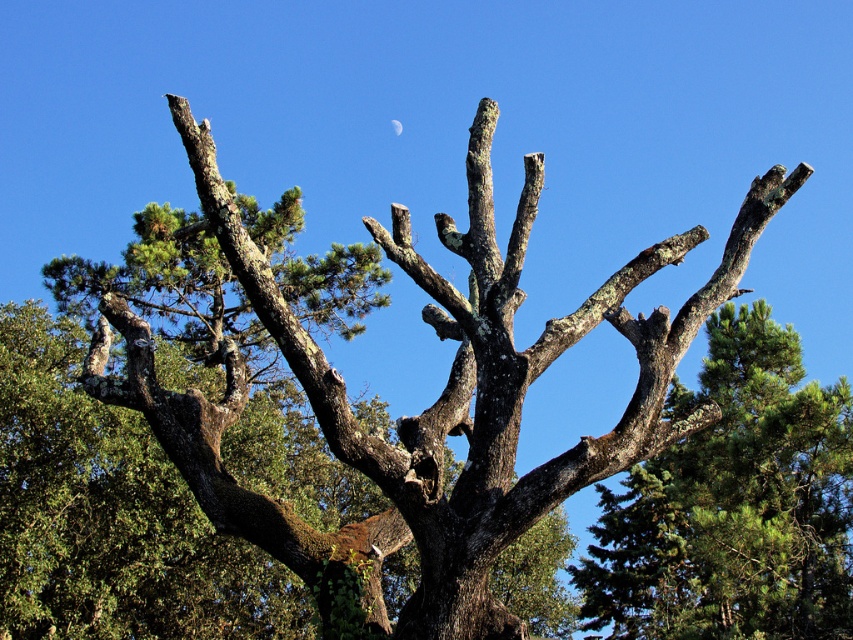
Question: Among these points, which one is nearest to the camera?

Choices:
 (A) (671, 636)
 (B) (390, 122)

Answer: (A)

Question: Among these objects, which one is farthest from the camera?

Choices:
 (A) green mossy branch at center
 (B) silver metallic moon at upper center

Answer: (B)

Question: Does green mossy branch at center have a lesser width compared to silver metallic moon at upper center?

Choices:
 (A) yes
 (B) no

Answer: (B)

Question: Among these points, which one is farthest from the camera?

Choices:
 (A) (602, 595)
 (B) (399, 122)

Answer: (B)

Question: Can you confirm if green mossy branch at center is thinner than silver metallic moon at upper center?

Choices:
 (A) no
 (B) yes

Answer: (A)

Question: Is the position of green mossy branch at center less distant than that of silver metallic moon at upper center?

Choices:
 (A) no
 (B) yes

Answer: (B)